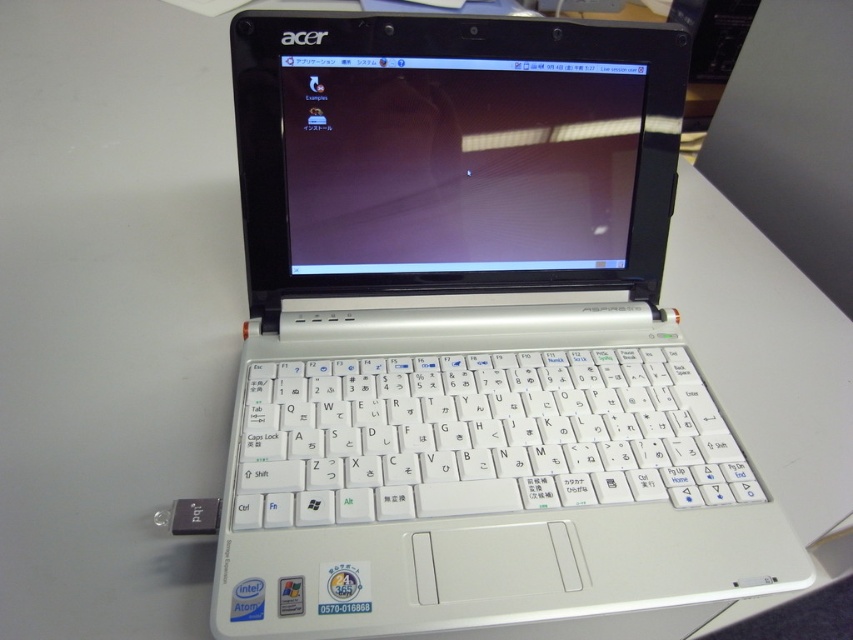
You are a technician trying to clean this laptop. You need to wipe the white plastic keyboard at center and the matte plastic screen at center. Which part should you clean first if you want to avoid getting liquid on the other part?

You should clean the white plastic keyboard at center first because it is in front of the matte plastic screen at center. Cleaning the keyboard first reduces the risk of liquid dripping onto the screen behind it.

You are setting up a laptop on a desk and want to ensure proper airflow. The white plastic laptop at center and the white plastic keyboard at center are both present. Which object should you adjust to improve airflow beneath the laptop?

The white plastic laptop at center is in front of the white plastic keyboard at center. To improve airflow, you should adjust the white plastic keyboard at center so that it doesn not block the space beneath the laptop.

You are setting up a new desk arrangement and want to place a small plant between the white plastic keyboard at center and the matte plastic screen at center. According to the image, which side of the keyboard should you place the plant to ensure it is between both objects?

The white plastic keyboard at center is to the right of the matte plastic screen at center, so placing the plant to the left of the keyboard would position it between the keyboard and the screen.